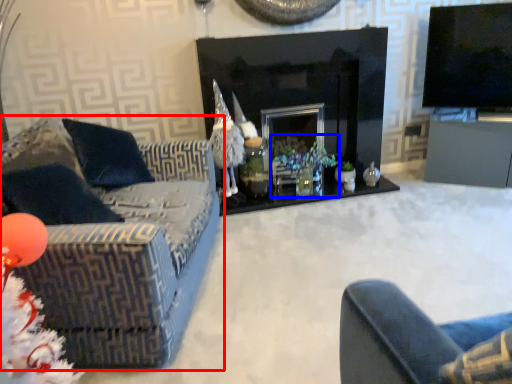
Question: Which object is closer to the camera taking this photo, studio couch (highlighted by a red box) or christmas decoration (highlighted by a blue box)?

Choices:
 (A) studio couch
 (B) christmas decoration

Answer: (A)